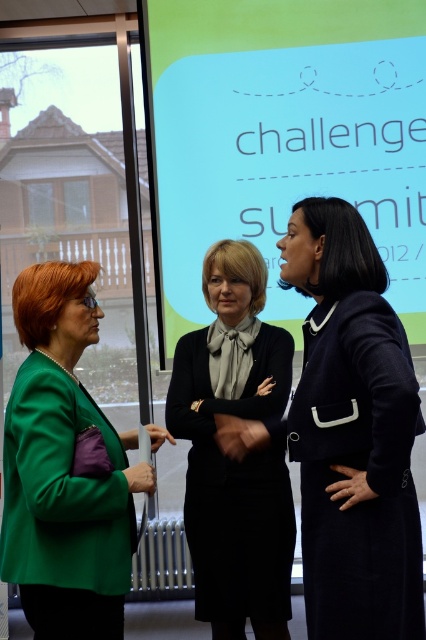
You are standing in the conference room and need to locate the matte black screen at center. According to the spatial coordinates provided, where exactly is the matte black screen positioned?

The matte black screen at center is located at point coordinates 0.216 on the x axis and 0.671 on the y axis.

You are setting up for a presentation and need to place a 30 cm wide laptop between the matte black screen at center and the green matte blazer at left. Can the laptop fit between them?

The matte black screen at center might be wider than the green matte blazer at left, so the laptop may fit between them if the distance is sufficient. However, the exact placement depends on the actual width of the screen compared to the blazer.

You are organizing a presentation and need to decide where to place a new projector screen. The current setup has a matte black screen at center and a navy blue coat at center. Which object is wider so that the projector screen can be adjusted accordingly?

The matte black screen at center is wider than the navy blue coat at center, so the projector screen should be adjusted to accommodate its width.